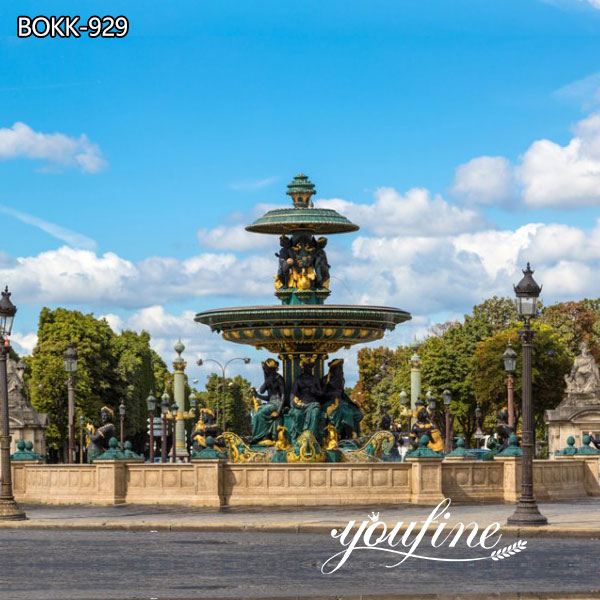
Find the location of `statue`. statue is located at coordinates (588, 388).